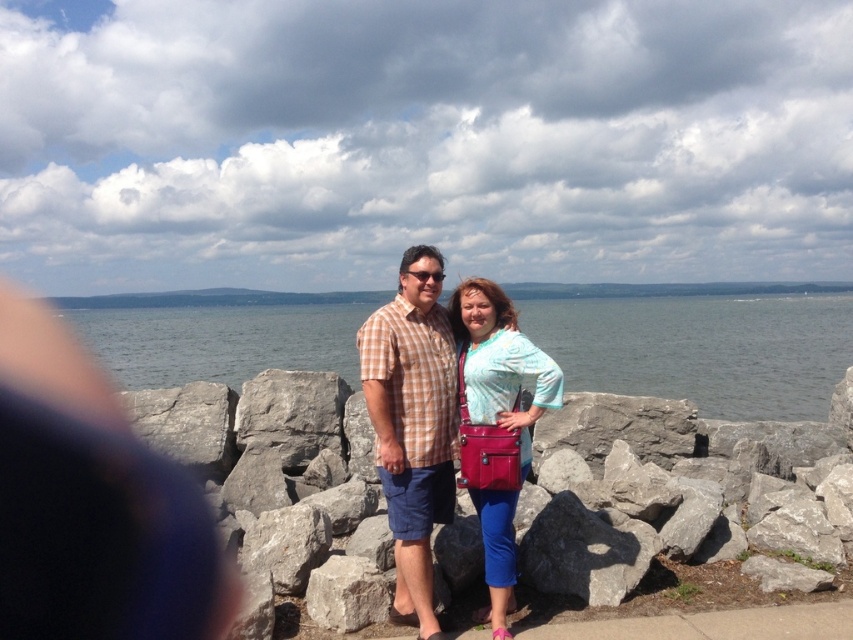
Question: Can you confirm if gray water at center is wider than matte pink purse at center?

Choices:
 (A) yes
 (B) no

Answer: (A)

Question: Does checkered fabric shirt at center come behind matte pink purse at center?

Choices:
 (A) yes
 (B) no

Answer: (A)

Question: Which point appears closest to the camera in this image?

Choices:
 (A) (675, 321)
 (B) (407, 561)
 (C) (485, 465)

Answer: (C)

Question: Can you confirm if checkered fabric shirt at center is positioned above matte pink purse at center?

Choices:
 (A) yes
 (B) no

Answer: (A)

Question: Which object is closer to the camera taking this photo?

Choices:
 (A) checkered fabric shirt at center
 (B) gray water at center

Answer: (A)

Question: Which point is closer to the camera taking this photo?

Choices:
 (A) (426, 268)
 (B) (494, 522)

Answer: (B)